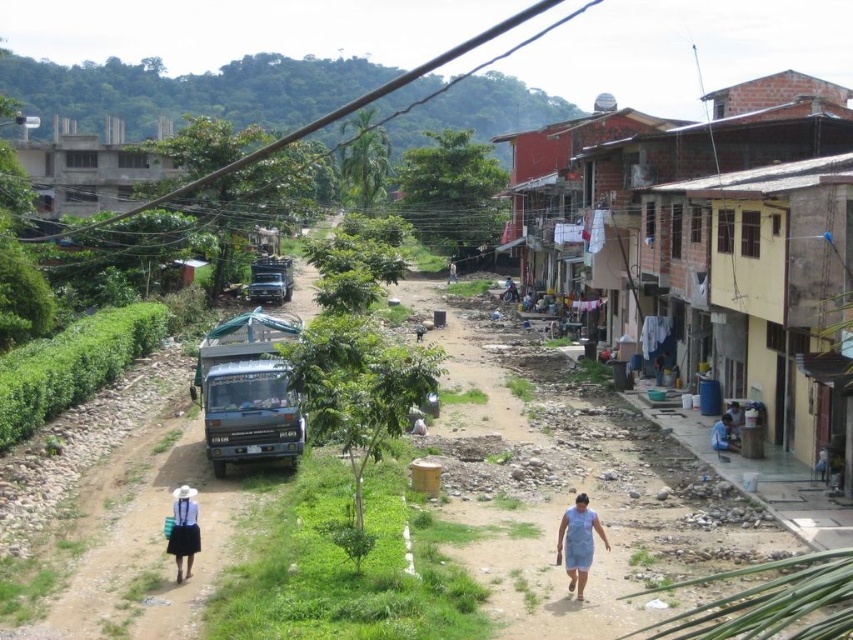
Is blue fabric dress at lower center to the right of white fabric at center from the viewer's perspective?

Correct, you'll find blue fabric dress at lower center to the right of white fabric at center.

Between blue fabric dress at lower center and white fabric at center, which one appears on the left side from the viewer's perspective?

white fabric at center is more to the left.

Locate an element on the screen. blue fabric dress at lower center is located at coordinates (578, 541).

I want to click on blue fabric dress at lower center, so click(578, 541).

Does blue matte truck at center appear under light blue fabric at lower right?

Incorrect, blue matte truck at center is not positioned below light blue fabric at lower right.

Is point (251, 378) positioned behind point (730, 420)?

That is False.

Identify the location of blue matte truck at center. This screenshot has height=640, width=853. (250, 413).

You are a GUI agent. You are given a task and a screenshot of the screen. Output one action in this format:
    pyautogui.click(x=<x>, y=<y>)
    Task: Click on the blue matte truck at center
    
    Given the screenshot: What is the action you would take?
    pyautogui.click(x=250, y=413)

Between blue matte truck at center and matte white hat at lower left, which one is positioned higher?

blue matte truck at center

This screenshot has width=853, height=640. Describe the element at coordinates (250, 413) in the screenshot. I see `blue matte truck at center` at that location.

Describe the element at coordinates (250, 413) in the screenshot. The height and width of the screenshot is (640, 853). I see `blue matte truck at center` at that location.

You are a GUI agent. You are given a task and a screenshot of the screen. Output one action in this format:
    pyautogui.click(x=<x>, y=<y>)
    Task: Click on the blue matte truck at center
    The image size is (853, 640).
    Given the screenshot: What is the action you would take?
    pyautogui.click(x=250, y=413)